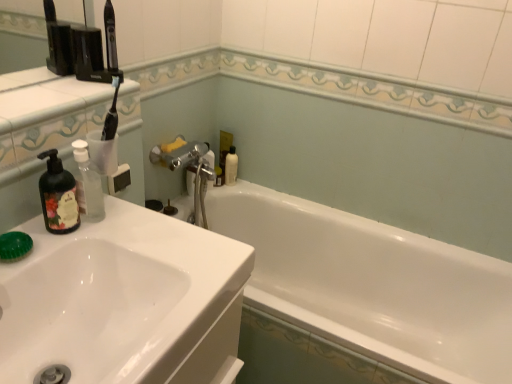
Locate an element on the screen. Image resolution: width=512 pixels, height=384 pixels. empty space that is to the right of clear plastic bottle at left is located at coordinates (144, 230).